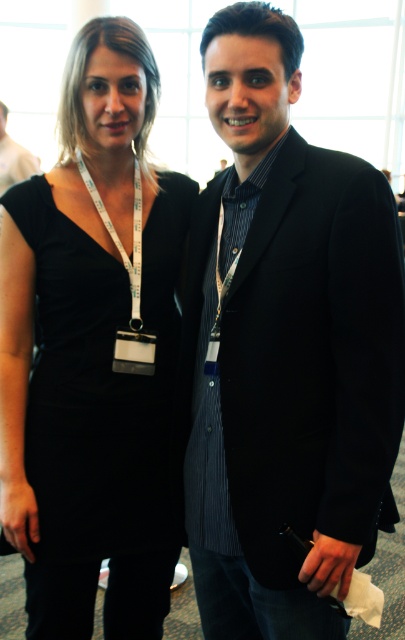
Question: Which object is farther from the camera taking this photo?

Choices:
 (A) black pinstripe suit at center
 (B) black matte dress at center

Answer: (B)

Question: Does black pinstripe suit at center have a smaller size compared to black matte dress at center?

Choices:
 (A) no
 (B) yes

Answer: (A)

Question: Can you confirm if black pinstripe suit at center is positioned above black matte dress at center?

Choices:
 (A) yes
 (B) no

Answer: (A)

Question: Which point is farther from the camera taking this photo?

Choices:
 (A) (319, 316)
 (B) (72, 216)

Answer: (B)

Question: Which of the following is the closest to the observer?

Choices:
 (A) black matte dress at center
 (B) black pinstripe suit at center

Answer: (B)

Question: Does black pinstripe suit at center have a greater width compared to black matte dress at center?

Choices:
 (A) no
 (B) yes

Answer: (A)